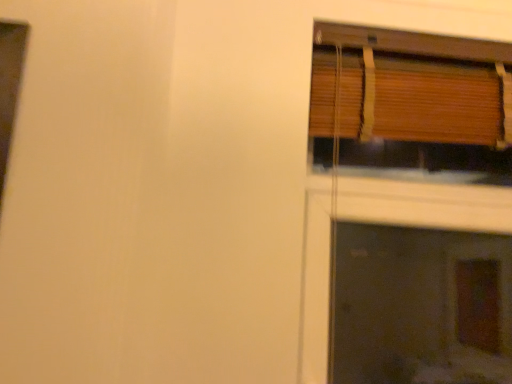
Question: Is point (321, 57) positioned closer to the camera than point (388, 304)?

Choices:
 (A) closer
 (B) farther

Answer: (A)

Question: Is wooden blinds at upper right wider or thinner than wooden blinds at upper right?

Choices:
 (A) wide
 (B) thin

Answer: (B)

Question: Would you say wooden blinds at upper right is inside or outside wooden blinds at upper right?

Choices:
 (A) outside
 (B) inside

Answer: (A)

Question: Is wooden blinds at upper right taller or shorter than wooden blinds at upper right?

Choices:
 (A) short
 (B) tall

Answer: (B)

Question: Considering the positions of wooden blinds at upper right and wooden blinds at upper right in the image, is wooden blinds at upper right wider or thinner than wooden blinds at upper right?

Choices:
 (A) thin
 (B) wide

Answer: (B)

Question: Does point (362, 182) appear closer or farther from the camera than point (412, 117)?

Choices:
 (A) closer
 (B) farther

Answer: (B)

Question: From the image's perspective, is wooden blinds at upper right positioned above or below wooden blinds at upper right?

Choices:
 (A) below
 (B) above

Answer: (A)